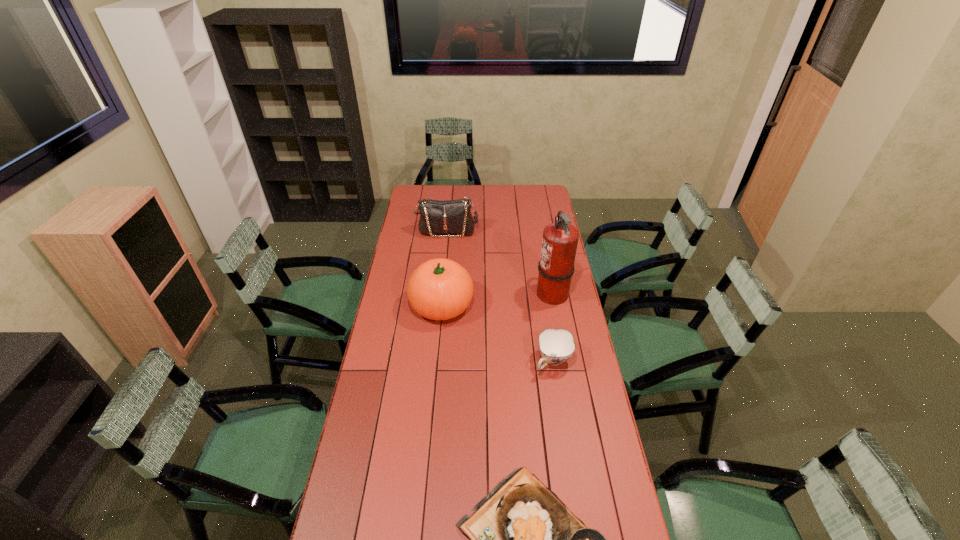
The width and height of the screenshot is (960, 540). Find the location of `vacant space positioned at the front of the third tallest object with chain and zipper`. vacant space positioned at the front of the third tallest object with chain and zipper is located at coordinates (443, 273).

In order to click on vacant region located 0.060m on the back of the chinaware in this screenshot , I will do `click(549, 334)`.

Find the location of `pumpkin positioned at the left edge`. pumpkin positioned at the left edge is located at coordinates (439, 289).

At what (x,y) coordinates should I click in order to perform the action: click on handbag located at the left edge. Please return your answer as a coordinate pair (x, y). Looking at the image, I should click on (450, 216).

Identify the location of fire extinguisher present at the right edge. This screenshot has width=960, height=540. (556, 267).

Find the location of `chinaware positioned at the right edge`. chinaware positioned at the right edge is located at coordinates click(556, 346).

Image resolution: width=960 pixels, height=540 pixels. In order to click on free space at the far edge of the desktop in this screenshot , I will do `click(467, 196)`.

The image size is (960, 540). In order to click on vacant space at the left edge of the desktop in this screenshot , I will do `click(390, 356)`.

The image size is (960, 540). Find the location of `vacant space at the right edge of the desktop`. vacant space at the right edge of the desktop is located at coordinates (571, 302).

Identify the location of free space at the far right corner of the desktop. (529, 190).